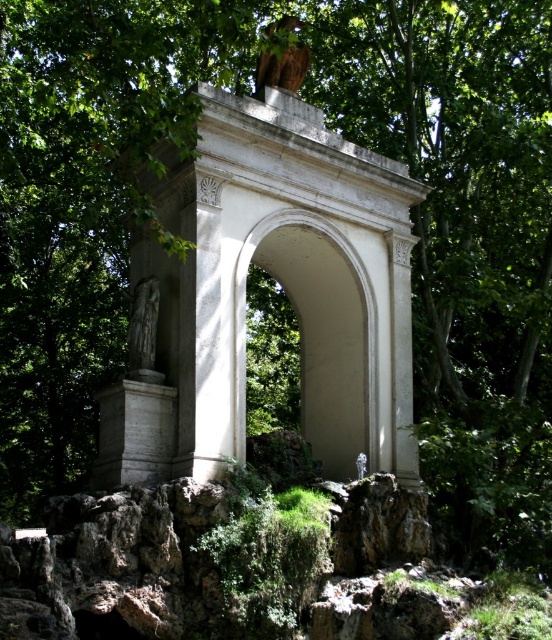
Question: Which point is farther to the camera?

Choices:
 (A) (284, 68)
 (B) (343, 301)
 (C) (151, 339)

Answer: (A)

Question: Among these points, which one is farthest from the camera?

Choices:
 (A) (140, 330)
 (B) (273, 22)
 (C) (342, 470)

Answer: (B)

Question: Which object is the closest to the wooden birdhouse at upper center?

Choices:
 (A) gray stone statue at center
 (B) white stone archway at center

Answer: (B)

Question: Observing the image, what is the correct spatial positioning of white stone archway at center in reference to wooden birdhouse at upper center?

Choices:
 (A) above
 (B) below

Answer: (B)

Question: Is gray stone statue at center to the left of wooden birdhouse at upper center from the viewer's perspective?

Choices:
 (A) no
 (B) yes

Answer: (B)

Question: From the image, what is the correct spatial relationship of white stone archway at center in relation to gray stone statue at center?

Choices:
 (A) right
 (B) left

Answer: (A)